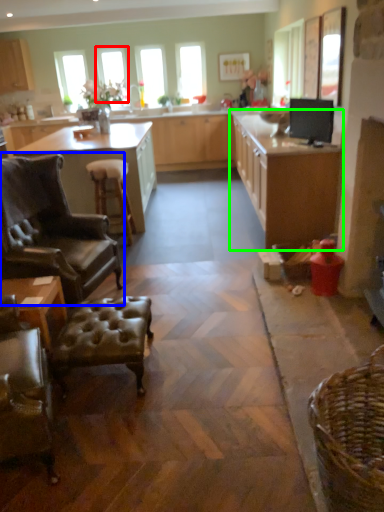
Question: Which object is positioned closest to window screen (highlighted by a red box)? Select from chair (highlighted by a blue box) and cabinetry (highlighted by a green box).

Choices:
 (A) chair
 (B) cabinetry

Answer: (B)